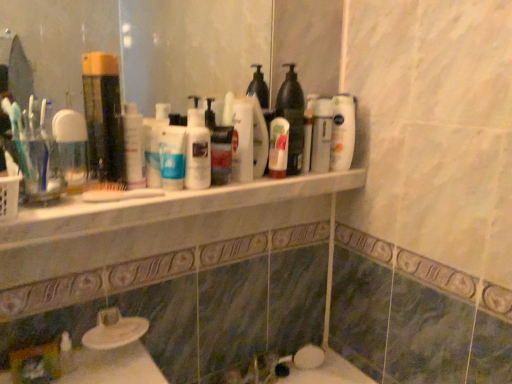
Image resolution: width=512 pixels, height=384 pixels. Describe the element at coordinates (103, 118) in the screenshot. I see `translucent plastic mouthwash at left, placed as the 2th mouthwash when sorted from left to right` at that location.

Describe the element at coordinates (197, 151) in the screenshot. I see `translucent plastic bottle at center, which is the second cleaning product from left to right` at that location.

Describe the element at coordinates (143, 45) in the screenshot. I see `clear glass mirror at upper center` at that location.

Image resolution: width=512 pixels, height=384 pixels. What do you see at coordinates (278, 148) in the screenshot? I see `white glossy lotion at center, the second toiletry positioned from the front` at bounding box center [278, 148].

The height and width of the screenshot is (384, 512). Identify the location of translucent plastic mouthwash at left, positioned as the first mouthwash in right-to-left order. (103, 118).

Would you say translucent plastic bottle at center, positioned as the fourth cleaning product in right-to-left order, is part of clear glass mirror at upper center's contents?

No, translucent plastic bottle at center, positioned as the fourth cleaning product in right-to-left order, is not a part of clear glass mirror at upper center.

Is clear glass mirror at upper center looking in the opposite direction of translucent plastic bottle at center, which is the second cleaning product from left to right?

Yes, clear glass mirror at upper center is facing away from translucent plastic bottle at center, which is the second cleaning product from left to right.

Based on the photo, considering the relative sizes of clear glass mirror at upper center and translucent plastic bottle at center, which is the second cleaning product from left to right, in the image provided, is clear glass mirror at upper center thinner than translucent plastic bottle at center, which is the second cleaning product from left to right,?

Indeed, clear glass mirror at upper center has a lesser width compared to translucent plastic bottle at center, which is the second cleaning product from left to right.

Is white glossy lotion at center, the first cleaning product positioned from the left, to the right of white glossy bottle at upper center, marked as the first cleaning product in a right-to-left arrangement, from the viewer's perspective?

In fact, white glossy lotion at center, the first cleaning product positioned from the left, is to the left of white glossy bottle at upper center, marked as the first cleaning product in a right-to-left arrangement.

Can you tell me how much white glossy lotion at center, the first cleaning product positioned from the left, and white glossy bottle at upper center, the 5th cleaning product viewed from the left, differ in facing direction?

0.606 degrees separate the facing orientations of white glossy lotion at center, the first cleaning product positioned from the left, and white glossy bottle at upper center, the 5th cleaning product viewed from the left.

How much distance is there between white glossy lotion at center, marked as the fifth cleaning product in a right-to-left arrangement, and white glossy bottle at upper center, marked as the first cleaning product in a right-to-left arrangement?

white glossy lotion at center, marked as the fifth cleaning product in a right-to-left arrangement, and white glossy bottle at upper center, marked as the first cleaning product in a right-to-left arrangement, are 21.69 inches apart from each other.

Is point (135, 122) closer or farther from the camera than point (350, 151)?

Point (135, 122) is positioned closer to the camera compared to point (350, 151).

How far apart are clear glass mirror at upper center and white glossy lotion at center, marked as the 1th toiletry in a front-to-back arrangement?

clear glass mirror at upper center is 4.83 feet from white glossy lotion at center, marked as the 1th toiletry in a front-to-back arrangement.

From the picture: Does clear glass mirror at upper center have a lesser height compared to white glossy lotion at center, marked as the second toiletry in a right-to-left arrangement?

In fact, clear glass mirror at upper center may be taller than white glossy lotion at center, marked as the second toiletry in a right-to-left arrangement.

Is clear glass mirror at upper center completely or partially outside of white glossy lotion at center, marked as the second toiletry in a right-to-left arrangement?

Yes, clear glass mirror at upper center is outside of white glossy lotion at center, marked as the second toiletry in a right-to-left arrangement.

In the scene shown: Which object is positioned more to the left, clear glass mirror at upper center or white glossy lotion at center, the first toiletry when ordered from left to right?

Positioned to the left is clear glass mirror at upper center.

Is translucent plastic mouthwash at left, placed as the 2th mouthwash when sorted from left to right, shorter than clear plastic cup at left, arranged as the 2th mouthwash when viewed from the right?

In fact, translucent plastic mouthwash at left, placed as the 2th mouthwash when sorted from left to right, may be taller than clear plastic cup at left, arranged as the 2th mouthwash when viewed from the right.

Considering the relative sizes of translucent plastic mouthwash at left, positioned as the first mouthwash in right-to-left order, and clear plastic cup at left, arranged as the 2th mouthwash when viewed from the right, in the image provided, is translucent plastic mouthwash at left, positioned as the first mouthwash in right-to-left order, thinner than clear plastic cup at left, arranged as the 2th mouthwash when viewed from the right,?

In fact, translucent plastic mouthwash at left, positioned as the first mouthwash in right-to-left order, might be wider than clear plastic cup at left, arranged as the 2th mouthwash when viewed from the right.

Measure the distance from translucent plastic mouthwash at left, positioned as the first mouthwash in right-to-left order, to clear plastic cup at left, arranged as the 2th mouthwash when viewed from the right.

The distance of translucent plastic mouthwash at left, positioned as the first mouthwash in right-to-left order, from clear plastic cup at left, arranged as the 2th mouthwash when viewed from the right, is 5.49 centimeters.

Considering the relative sizes of translucent plastic mouthwash at left, placed as the 2th mouthwash when sorted from left to right, and clear plastic cup at left, the first mouthwash viewed from the left, in the image provided, is translucent plastic mouthwash at left, placed as the 2th mouthwash when sorted from left to right, bigger than clear plastic cup at left, the first mouthwash viewed from the left,?

Indeed, translucent plastic mouthwash at left, placed as the 2th mouthwash when sorted from left to right, has a larger size compared to clear plastic cup at left, the first mouthwash viewed from the left.

From a real-world perspective, is clear glass mirror at upper center positioned over translucent plastic bottle at upper center, the 2th cleaning product viewed from the right, based on gravity?

Yes.

Who is taller, clear glass mirror at upper center or translucent plastic bottle at upper center, the 2th cleaning product viewed from the right?

clear glass mirror at upper center is taller.

In the image, there is a translucent plastic bottle at upper center, acting as the 4th cleaning product starting from the left. Where is `mirror above it (from the image's perspective)`? mirror above it (from the image's perspective) is located at coordinates (143, 45).

From a real-world perspective, is white glossy bottle at upper center, the 5th cleaning product viewed from the left, on top of white glossy lotion at center, the first toiletry when ordered from left to right?

Correct, in the physical world, white glossy bottle at upper center, the 5th cleaning product viewed from the left, is higher than white glossy lotion at center, the first toiletry when ordered from left to right.

Which of these two, white glossy bottle at upper center, marked as the first cleaning product in a right-to-left arrangement, or white glossy lotion at center, marked as the second toiletry in a right-to-left arrangement, stands shorter?

white glossy lotion at center, marked as the second toiletry in a right-to-left arrangement.

From the image's perspective, would you say white glossy bottle at upper center, the 5th cleaning product viewed from the left, is positioned over white glossy lotion at center, marked as the 1th toiletry in a front-to-back arrangement?

Yes, from the image's perspective, white glossy bottle at upper center, the 5th cleaning product viewed from the left, is above white glossy lotion at center, marked as the 1th toiletry in a front-to-back arrangement.

Is white glossy bottle at upper center, the 5th cleaning product viewed from the left, oriented towards white glossy lotion at center, the 2th toiletry viewed from the back?

No, white glossy bottle at upper center, the 5th cleaning product viewed from the left, is not aimed at white glossy lotion at center, the 2th toiletry viewed from the back.

Is white glossy bottle at upper center, the 5th cleaning product viewed from the left, in front of translucent plastic bottle at upper center, the 2th cleaning product viewed from the right?

No, it is not.

Based on the photo, which point is more forward, (x=338, y=132) or (x=292, y=174)?

Positioned in front is point (x=292, y=174).

From the image's perspective, would you say white glossy bottle at upper center, the 5th cleaning product viewed from the left, is shown under translucent plastic bottle at upper center, the 2th cleaning product viewed from the right?

Yes, from the image's perspective, white glossy bottle at upper center, the 5th cleaning product viewed from the left, is beneath translucent plastic bottle at upper center, the 2th cleaning product viewed from the right.

Find the location of a particular element. the 1st cleaning product counting from the right side of the clear glass mirror at upper center is located at coordinates (197, 151).

Find the location of a particular element. cleaning product that is the 1st one below the white glossy bottle at upper center, marked as the first cleaning product in a right-to-left arrangement (from a real-world perspective) is located at coordinates (134, 146).

Consider the image. Looking at the image, which one is located further to translucent plastic mouthwash at left, positioned as the first mouthwash in right-to-left order, white marble counter at center or clear glass mirror at upper center?

clear glass mirror at upper center lies further to translucent plastic mouthwash at left, positioned as the first mouthwash in right-to-left order, than the other object.

Which object lies further to the anchor point white glossy bottle at upper center, marked as the first cleaning product in a right-to-left arrangement, white marble counter at center or clear glass mirror at upper center?

clear glass mirror at upper center.

From the image, which object appears to be nearer to translucent plastic mouthwash at left, positioned as the first mouthwash in right-to-left order, white glossy bottle at upper center, marked as the first cleaning product in a right-to-left arrangement, or clear plastic cup at left, arranged as the 2th mouthwash when viewed from the right?

The object closer to translucent plastic mouthwash at left, positioned as the first mouthwash in right-to-left order, is clear plastic cup at left, arranged as the 2th mouthwash when viewed from the right.

Estimate the real-world distances between objects in this image. Which object is further from white marble counter at center, translucent plastic bottle at upper center, acting as the 4th cleaning product starting from the left, or white glossy lotion at center, marked as the fifth cleaning product in a right-to-left arrangement?

translucent plastic bottle at upper center, acting as the 4th cleaning product starting from the left, is positioned further to the anchor white marble counter at center.

From the image, which object appears to be farther from white glossy lotion at center, the 2th toiletry viewed from the back, white glossy lotion at center, marked as the fifth cleaning product in a right-to-left arrangement, or translucent plastic mouthwash at left, placed as the 2th mouthwash when sorted from left to right?

translucent plastic mouthwash at left, placed as the 2th mouthwash when sorted from left to right, is positioned further to the anchor white glossy lotion at center, the 2th toiletry viewed from the back.

Considering their positions, is translucent plastic bottle at upper center, acting as the 4th cleaning product starting from the left, positioned closer to clear plastic cup at left, arranged as the 2th mouthwash when viewed from the right, than white glossy lotion at center, marked as the fifth cleaning product in a right-to-left arrangement?

Based on the image, white glossy lotion at center, marked as the fifth cleaning product in a right-to-left arrangement, appears to be nearer to clear plastic cup at left, arranged as the 2th mouthwash when viewed from the right.

Estimate the real-world distances between objects in this image. Which object is closer to white glossy lotion at center, the 1th toiletry in the back-to-front sequence, clear plastic cup at left, arranged as the 2th mouthwash when viewed from the right, or white glossy bottle at upper center, the 5th cleaning product viewed from the left?

The object closer to white glossy lotion at center, the 1th toiletry in the back-to-front sequence, is white glossy bottle at upper center, the 5th cleaning product viewed from the left.

Based on their spatial positions, is translucent plastic bottle at center, which is the second cleaning product from left to right, or clear glass mirror at upper center closer to translucent plastic mouthwash at left, positioned as the first mouthwash in right-to-left order?

translucent plastic bottle at center, which is the second cleaning product from left to right, is closer to translucent plastic mouthwash at left, positioned as the first mouthwash in right-to-left order.

This screenshot has width=512, height=384. Identify the location of toiletry located between translucent plastic bottle at center, positioned as the fourth cleaning product in right-to-left order, and white glossy bottle at upper center, marked as the first cleaning product in a right-to-left arrangement, in the left-right direction. (278, 148).

Where is `toiletry located between white glossy lotion at center, marked as the fifth cleaning product in a right-to-left arrangement, and white glossy lotion at center, the 1th toiletry in the back-to-front sequence, in the left-right direction`? The height and width of the screenshot is (384, 512). toiletry located between white glossy lotion at center, marked as the fifth cleaning product in a right-to-left arrangement, and white glossy lotion at center, the 1th toiletry in the back-to-front sequence, in the left-right direction is located at coordinates (172, 157).

The image size is (512, 384). What are the coordinates of `mirror between translucent plastic mouthwash at left, positioned as the first mouthwash in right-to-left order, and white glossy lotion at center, the 1th toiletry in the back-to-front sequence, from left to right` in the screenshot? It's located at (143, 45).

Locate an element on the screen. The image size is (512, 384). mirror between translucent plastic mouthwash at left, placed as the 2th mouthwash when sorted from left to right, and white glossy bottle at upper center, the 5th cleaning product viewed from the left, in the horizontal direction is located at coordinates (143, 45).